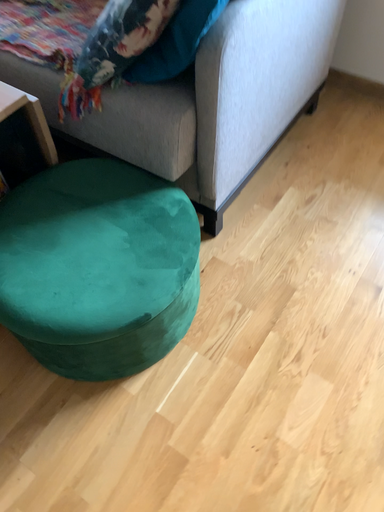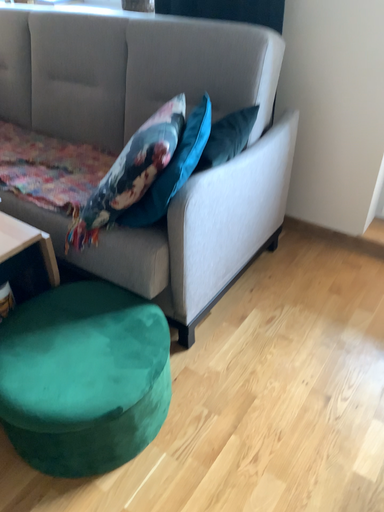
Question: Which way did the camera rotate in the video?

Choices:
 (A) rotated upward
 (B) rotated downward

Answer: (A)